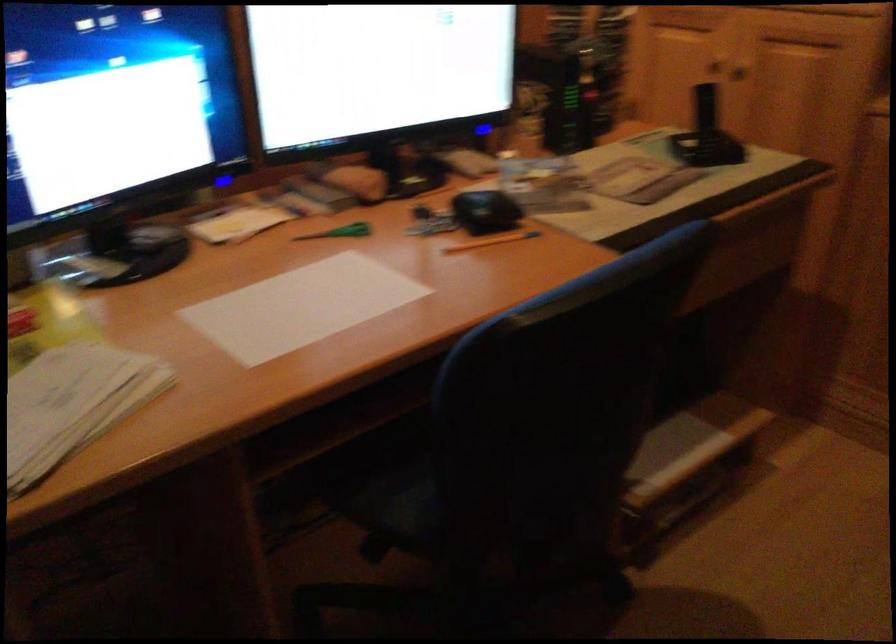
In order to click on blue chair sitting surface in this screenshot , I will do `click(400, 488)`.